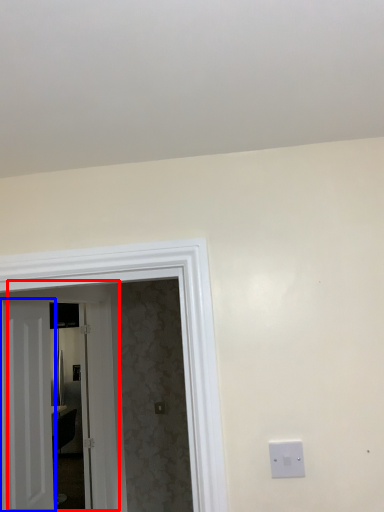
Question: Which of the following is the farthest to the observer, door (highlighted by a red box) or door (highlighted by a blue box)?

Choices:
 (A) door
 (B) door

Answer: (B)